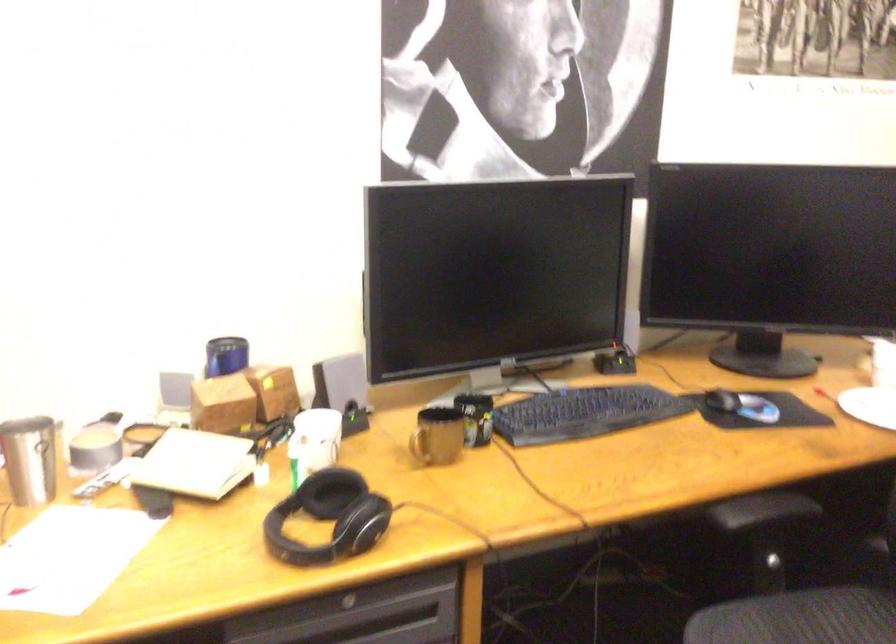
Where is `brown mug handle`? brown mug handle is located at coordinates (419, 446).